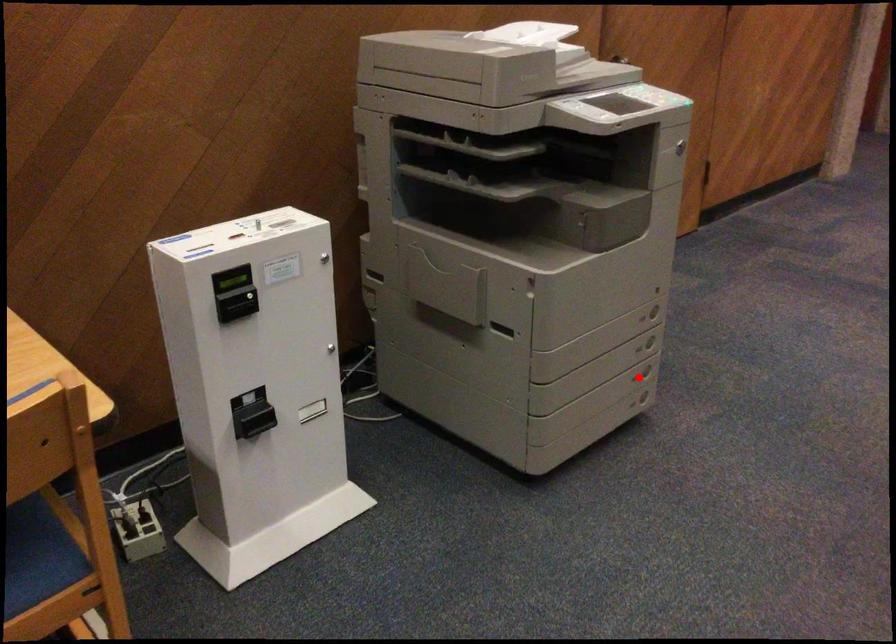
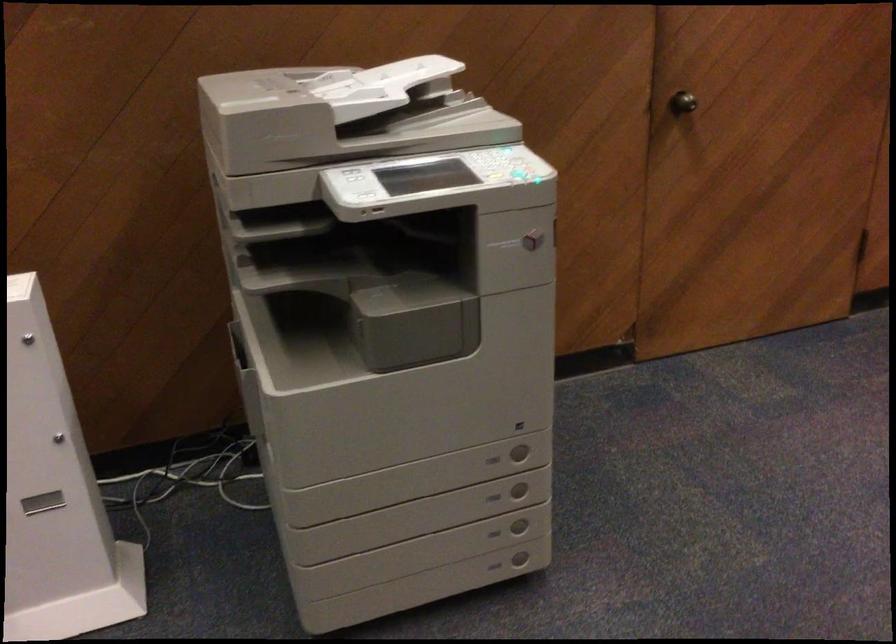
Question: A red point is marked in image1. In image2, is the corresponding 3D point closer to the camera or farther? Reply with the corresponding letter.

Choices:
 (A) The corresponding 3D point is closer.
 (B) The corresponding 3D point is farther.

Answer: (A)